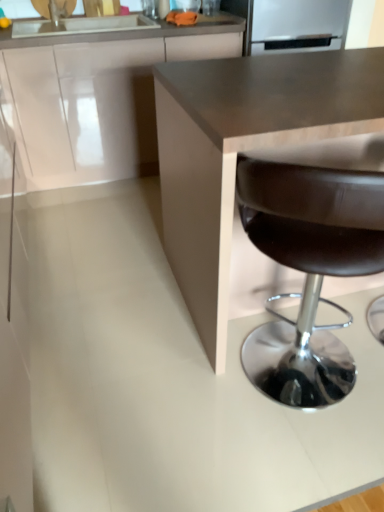
You are a GUI agent. You are given a task and a screenshot of the screen. Output one action in this format:
    pyautogui.click(x=<x>, y=<y>)
    Task: Click on the brown leather stool at lower right
    This screenshot has height=512, width=384.
    Given the screenshot: What is the action you would take?
    pyautogui.click(x=311, y=257)

In order to click on white glossy cabinet at upper left in this screenshot , I will do `click(93, 99)`.

You are a GUI agent. You are given a task and a screenshot of the screen. Output one action in this format:
    pyautogui.click(x=<x>, y=<y>)
    Task: Click on the satin silver refrigerator at upper center
    
    Given the screenshot: What is the action you would take?
    pyautogui.click(x=296, y=25)

How far apart are brown leather stool at lower right and white glossy cabinet at upper left?

brown leather stool at lower right is 1.45 meters from white glossy cabinet at upper left.

Between brown leather stool at lower right and white glossy cabinet at upper left, which one is positioned behind?

Positioned behind is white glossy cabinet at upper left.

Is brown leather stool at lower right turned away from white glossy cabinet at upper left?

brown leather stool at lower right is not turned away from white glossy cabinet at upper left.

Is point (281, 156) behind point (91, 82)?

No, it is not.

From the image's perspective, is white glossy cabinet at upper left on top of matte brown countertop at center?

Correct, white glossy cabinet at upper left appears higher than matte brown countertop at center in the image.

Are white glossy cabinet at upper left and matte brown countertop at center beside each other?

No, white glossy cabinet at upper left is not with matte brown countertop at center.

At what (x,y) coordinates should I click in order to perform the action: click on countertop in front of the white glossy cabinet at upper left. Please return your answer as a coordinate pair (x, y). This screenshot has width=384, height=512. Looking at the image, I should click on (243, 150).

Is white glossy cabinet at upper left inside the boundaries of matte brown countertop at center, or outside?

white glossy cabinet at upper left is spatially situated outside matte brown countertop at center.

Would you say satin silver refrigerator at upper center is part of matte brown countertop at center's contents?

No.

Who is taller, matte brown countertop at center or satin silver refrigerator at upper center?

With more height is matte brown countertop at center.

Is matte brown countertop at center smaller than satin silver refrigerator at upper center?

No, matte brown countertop at center is not smaller than satin silver refrigerator at upper center.

Where is `appliance on the left of matte brown countertop at center`? appliance on the left of matte brown countertop at center is located at coordinates (296, 25).

From a real-world perspective, is white glossy cabinet at upper left located beneath satin silver refrigerator at upper center?

Yes.

Based on their sizes in the image, would you say white glossy cabinet at upper left is bigger or smaller than satin silver refrigerator at upper center?

In the image, white glossy cabinet at upper left appears to be larger than satin silver refrigerator at upper center.

You are a GUI agent. You are given a task and a screenshot of the screen. Output one action in this format:
    pyautogui.click(x=<x>, y=<y>)
    Task: Click on the appliance on the right of white glossy cabinet at upper left
    The height and width of the screenshot is (512, 384).
    Given the screenshot: What is the action you would take?
    coord(296,25)

Considering the sizes of white glossy cabinet at upper left and satin silver refrigerator at upper center in the image, is white glossy cabinet at upper left taller or shorter than satin silver refrigerator at upper center?

white glossy cabinet at upper left is taller than satin silver refrigerator at upper center.

Considering the sizes of objects satin silver refrigerator at upper center and white glossy cabinet at upper left in the image provided, who is bigger, satin silver refrigerator at upper center or white glossy cabinet at upper left?

With larger size is white glossy cabinet at upper left.

Does satin silver refrigerator at upper center have a greater height compared to white glossy cabinet at upper left?

No, satin silver refrigerator at upper center is not taller than white glossy cabinet at upper left.

From a real-world perspective, which object rests below the other?

brown leather stool at lower right, from a real-world perspective.

Can you see white glossy cabinet at upper left touching brown leather stool at lower right?

No, white glossy cabinet at upper left is not in contact with brown leather stool at lower right.

Does point (154, 106) come farther from viewer compared to point (315, 159)?

Yes.

Could you tell me if white glossy cabinet at upper left is facing brown leather stool at lower right?

Yes.

Considering the relative sizes of matte brown countertop at center and brown leather stool at lower right in the image provided, is matte brown countertop at center shorter than brown leather stool at lower right?

No, matte brown countertop at center is not shorter than brown leather stool at lower right.

Is matte brown countertop at center not near brown leather stool at lower right?

matte brown countertop at center is near brown leather stool at lower right, not far away.

Is matte brown countertop at center oriented away from brown leather stool at lower right?

No, matte brown countertop at center is not facing away from brown leather stool at lower right.

From a real-world perspective, which is physically below, matte brown countertop at center or brown leather stool at lower right?

In real-world perspective, brown leather stool at lower right is lower.

You are a GUI agent. You are given a task and a screenshot of the screen. Output one action in this format:
    pyautogui.click(x=<x>, y=<y>)
    Task: Click on the cabinetry behind the brown leather stool at lower right
    
    Given the screenshot: What is the action you would take?
    pyautogui.click(x=93, y=99)

Identify the location of countertop that appears below the white glossy cabinet at upper left (from a real-world perspective). The image size is (384, 512). (243, 150).

Considering their positions, is brown leather stool at lower right positioned further to white glossy cabinet at upper left than matte brown countertop at center?

Among the two, brown leather stool at lower right is located further to white glossy cabinet at upper left.

Which object lies further to the anchor point brown leather stool at lower right, satin silver refrigerator at upper center or white glossy cabinet at upper left?

satin silver refrigerator at upper center.

When comparing their distances from brown leather stool at lower right, does matte brown countertop at center or satin silver refrigerator at upper center seem further?

satin silver refrigerator at upper center.

From the image, which object appears to be farther from matte brown countertop at center, satin silver refrigerator at upper center or brown leather stool at lower right?

satin silver refrigerator at upper center lies further to matte brown countertop at center than the other object.

Considering their positions, is satin silver refrigerator at upper center positioned further to matte brown countertop at center than white glossy cabinet at upper left?

satin silver refrigerator at upper center is positioned further to the anchor matte brown countertop at center.

From the image, which object appears to be farther from matte brown countertop at center, white glossy cabinet at upper left or satin silver refrigerator at upper center?

Based on the image, satin silver refrigerator at upper center appears to be further to matte brown countertop at center.

From the image, which object appears to be farther from matte brown countertop at center, brown leather stool at lower right or white glossy cabinet at upper left?

The object further to matte brown countertop at center is white glossy cabinet at upper left.

In the scene shown: Based on their spatial positions, is white glossy cabinet at upper left or brown leather stool at lower right further from satin silver refrigerator at upper center?

brown leather stool at lower right lies further to satin silver refrigerator at upper center than the other object.

Where is `cabinetry between matte brown countertop at center and satin silver refrigerator at upper center in the front-back direction`? cabinetry between matte brown countertop at center and satin silver refrigerator at upper center in the front-back direction is located at coordinates (93, 99).

Find the location of a particular element. The image size is (384, 512). countertop between brown leather stool at lower right and white glossy cabinet at upper left in the front-back direction is located at coordinates (243, 150).

Where is `countertop between brown leather stool at lower right and satin silver refrigerator at upper center from front to back`? countertop between brown leather stool at lower right and satin silver refrigerator at upper center from front to back is located at coordinates (243, 150).

Identify the location of cabinetry between brown leather stool at lower right and satin silver refrigerator at upper center in the front-back direction. Image resolution: width=384 pixels, height=512 pixels. (93, 99).